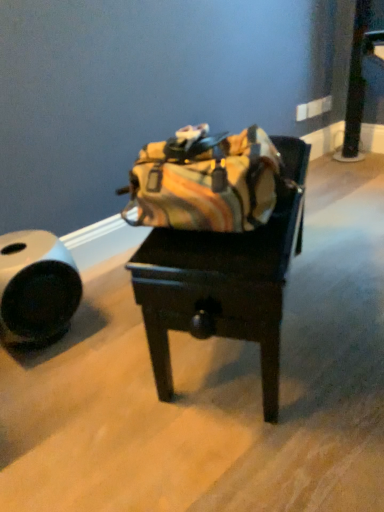
Locate an element on the screen. vacant area in front of white matte tube at left is located at coordinates (44, 387).